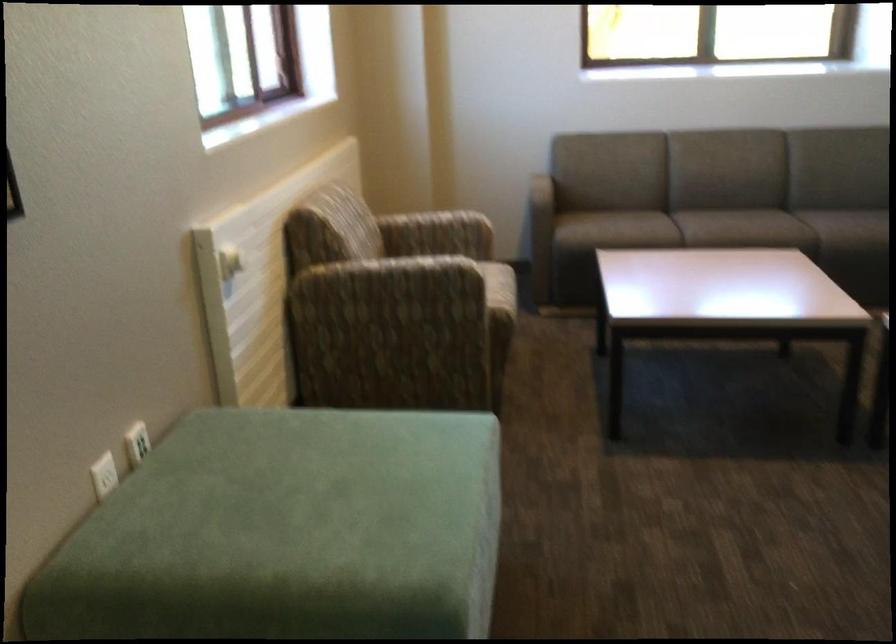
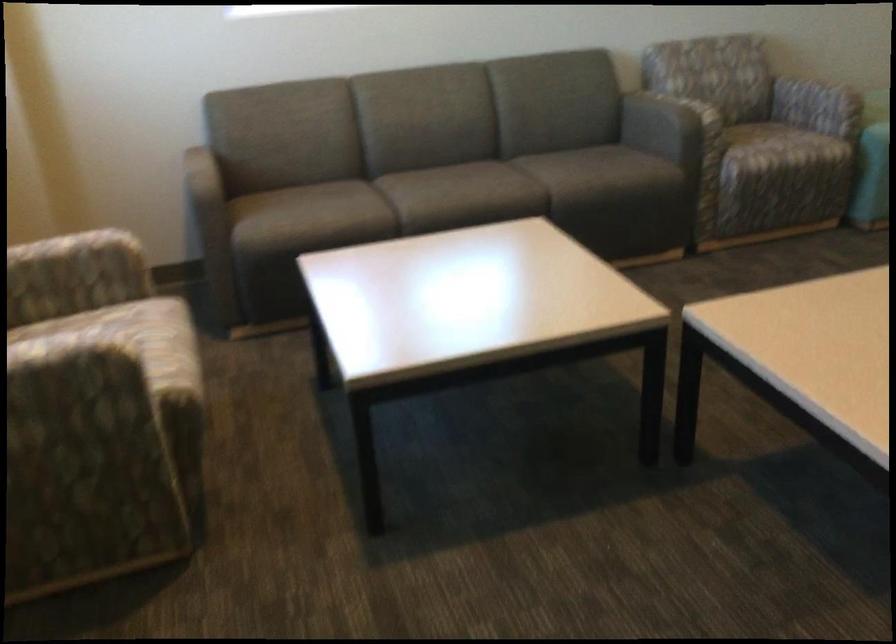
Question: The first image is from the beginning of the video and the second image is from the end. How did the camera likely rotate when shooting the video?

Choices:
 (A) Left
 (B) Right
 (C) Up
 (D) Down

Answer: (B)